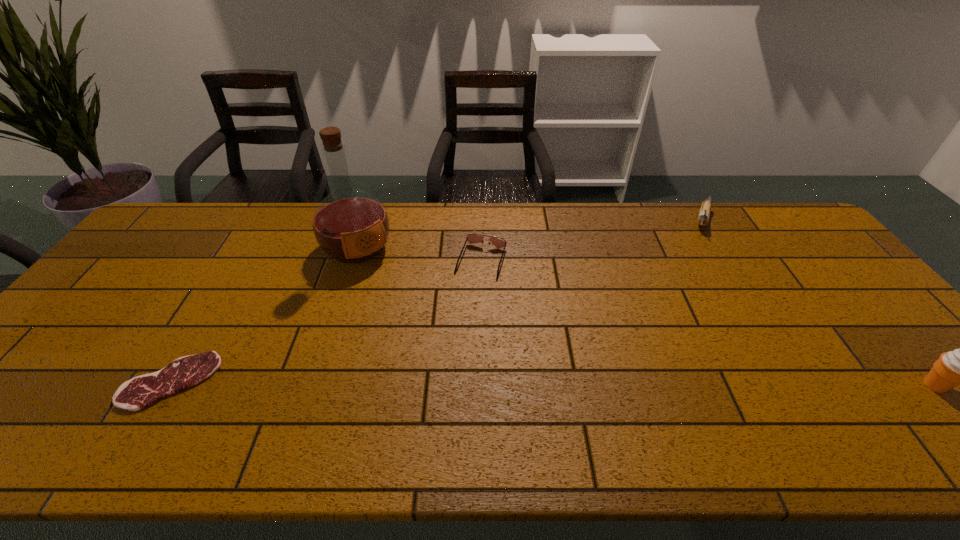
Locate an element on the screen. vacant space on the desktop that is between the steak and the icecream and is positioned on the front label of the fourth object from right to left is located at coordinates (466, 383).

Identify the location of vacant space on the desktop that is between the leftmost object and the icecream and is positioned on the bridge of the sunglasses. The image size is (960, 540). (438, 382).

Where is `free space on the desktop that is between the leftmost object and the fourth shortest object and is positioned on the peel of the fourth object from left to right`? free space on the desktop that is between the leftmost object and the fourth shortest object and is positioned on the peel of the fourth object from left to right is located at coordinates (656, 384).